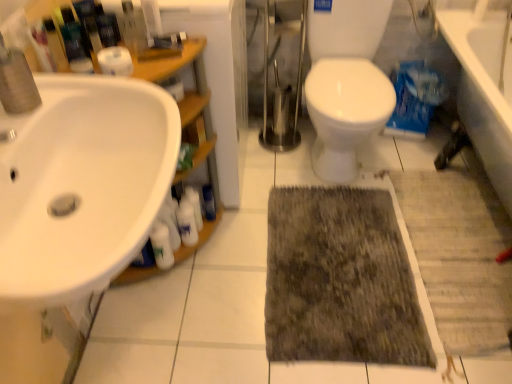
Question: Is white glossy bottle at lower left, marked as the second toiletry in a right-to-left arrangement, shorter than white matte toilet paper at upper left?

Choices:
 (A) no
 (B) yes

Answer: (A)

Question: Does white glossy bottle at lower left, positioned as the 1th toiletry in left-to-right order, appear on the left side of white matte toilet paper at upper left?

Choices:
 (A) yes
 (B) no

Answer: (B)

Question: Considering the relative sizes of white glossy bottle at lower left, marked as the second toiletry in a right-to-left arrangement, and white matte toilet paper at upper left in the image provided, is white glossy bottle at lower left, marked as the second toiletry in a right-to-left arrangement, taller than white matte toilet paper at upper left?

Choices:
 (A) yes
 (B) no

Answer: (A)

Question: From the image's perspective, would you say white glossy bottle at lower left, marked as the second toiletry in a right-to-left arrangement, is shown under white matte toilet paper at upper left?

Choices:
 (A) yes
 (B) no

Answer: (A)

Question: Does white glossy bottle at lower left, positioned as the 1th toiletry in left-to-right order, turn towards white matte toilet paper at upper left?

Choices:
 (A) no
 (B) yes

Answer: (A)

Question: Is white glossy bottle at lower left, marked as the second cleaning product in a right-to-left arrangement, inside or outside of white glossy sink at left?

Choices:
 (A) outside
 (B) inside

Answer: (A)

Question: Considering the positions of point (159, 231) and point (73, 119), is point (159, 231) closer or farther from the camera than point (73, 119)?

Choices:
 (A) farther
 (B) closer

Answer: (A)

Question: Looking at the image, does white glossy bottle at lower left, which is the first cleaning product from left to right, seem bigger or smaller compared to white glossy sink at left?

Choices:
 (A) big
 (B) small

Answer: (B)

Question: Based on their positions, is white glossy bottle at lower left, marked as the second cleaning product in a right-to-left arrangement, located to the left or right of white glossy sink at left?

Choices:
 (A) left
 (B) right

Answer: (B)

Question: Relative to white matte toilet paper at upper left, is white glossy sink at left in front or behind?

Choices:
 (A) behind
 (B) front

Answer: (B)

Question: In terms of height, does white glossy sink at left look taller or shorter compared to white matte toilet paper at upper left?

Choices:
 (A) tall
 (B) short

Answer: (A)

Question: Does point pos(84,117) appear closer or farther from the camera than point pos(121,48)?

Choices:
 (A) farther
 (B) closer

Answer: (B)

Question: Choose the correct answer: Is white glossy sink at left inside white matte toilet paper at upper left or outside it?

Choices:
 (A) outside
 (B) inside

Answer: (A)

Question: Is white glossy bottle at center, positioned as the 2th toiletry in left-to-right order, spatially inside white glossy sink at left, or outside of it?

Choices:
 (A) inside
 (B) outside

Answer: (B)

Question: In terms of width, does white glossy bottle at center, positioned as the 2th toiletry in left-to-right order, look wider or thinner when compared to white glossy sink at left?

Choices:
 (A) thin
 (B) wide

Answer: (A)